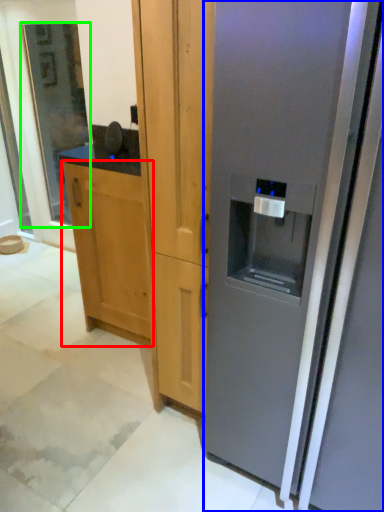
Question: Considering the real-world distances, which object is closest to cabinetry (highlighted by a red box)? refrigerator (highlighted by a blue box) or glass door (highlighted by a green box).

Choices:
 (A) refrigerator
 (B) glass door

Answer: (A)